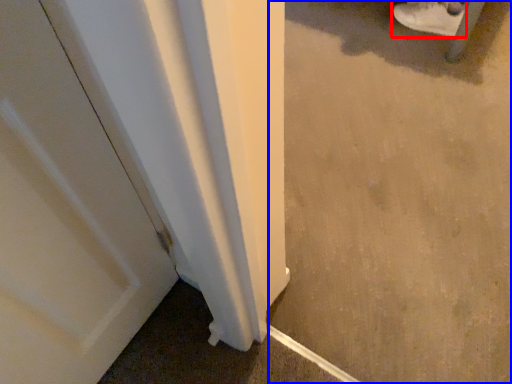
Question: Which object appears farthest to the camera in this image, footwear (highlighted by a red box) or concrete (highlighted by a blue box)?

Choices:
 (A) footwear
 (B) concrete

Answer: (A)